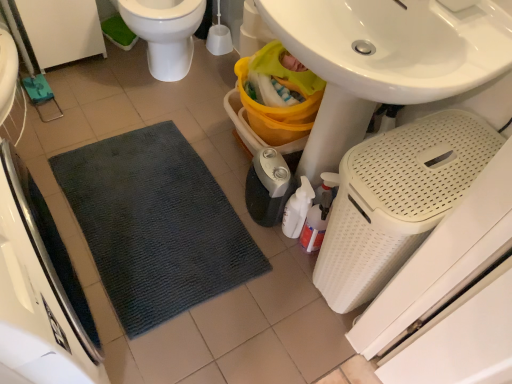
Locate an element on the screen. The width and height of the screenshot is (512, 384). white glossy toilet at upper left is located at coordinates (165, 33).

Considering the sizes of white perforated laundry basket at lower right, arranged as the 1th appliance when viewed from the right, and white glossy toilet at upper left in the image, is white perforated laundry basket at lower right, arranged as the 1th appliance when viewed from the right, wider or thinner than white glossy toilet at upper left?

In the image, white perforated laundry basket at lower right, arranged as the 1th appliance when viewed from the right, appears to be more narrow than white glossy toilet at upper left.

Can you confirm if white perforated laundry basket at lower right, the 3th appliance when ordered from left to right, is smaller than white glossy toilet at upper left?

Indeed, white perforated laundry basket at lower right, the 3th appliance when ordered from left to right, has a smaller size compared to white glossy toilet at upper left.

Between point (384, 274) and point (195, 14), which one is positioned in front?

Point (384, 274)

Is white perforated laundry basket at lower right, arranged as the 1th appliance when viewed from the right, oriented away from white glossy toilet at upper left?

white perforated laundry basket at lower right, arranged as the 1th appliance when viewed from the right, does not have its back to white glossy toilet at upper left.

Based on the photo, would you say translucent plastic spray bottle at lower center is to the left or to the right of black plastic humidifier at lower center, the 2th appliance from the right, in the picture?

Clearly, translucent plastic spray bottle at lower center is on the right of black plastic humidifier at lower center, the 2th appliance from the right, in the image.

Where is `cleaning product on the right of black plastic humidifier at lower center, the second appliance when ordered from left to right`? The height and width of the screenshot is (384, 512). cleaning product on the right of black plastic humidifier at lower center, the second appliance when ordered from left to right is located at coordinates (319, 214).

Does translucent plastic spray bottle at lower center have a lesser height compared to black plastic humidifier at lower center, the second appliance when ordered from left to right?

Incorrect, the height of translucent plastic spray bottle at lower center does not fall short of that of black plastic humidifier at lower center, the second appliance when ordered from left to right.

From a real-world perspective, is translucent plastic spray bottle at lower center on top of black plastic humidifier at lower center, the second appliance when ordered from left to right?

Yes, from a real-world perspective, translucent plastic spray bottle at lower center is above black plastic humidifier at lower center, the second appliance when ordered from left to right.

From the white glossy toilet at upper left, count 3rd appliances forward and point to it. Please provide its 2D coordinates.

[(36, 296)]

Does white glossy toilet at upper left have a greater width compared to dark gray textured mat at lower left, arranged as the 3th appliance when viewed from the right?

Yes.

Could you tell me if white glossy toilet at upper left is facing dark gray textured mat at lower left, which ranks as the first appliance in left-to-right order?

Yes, white glossy toilet at upper left is facing dark gray textured mat at lower left, which ranks as the first appliance in left-to-right order.

Which object is closer to the camera, white glossy toilet at upper left or dark gray textured mat at lower left, which ranks as the first appliance in left-to-right order?

dark gray textured mat at lower left, which ranks as the first appliance in left-to-right order.

Is white perforated laundry basket at lower right, the 3th appliance when ordered from left to right, positioned with its back to black plastic humidifier at lower center, the second appliance when ordered from left to right?

No, black plastic humidifier at lower center, the second appliance when ordered from left to right, is not at the back of white perforated laundry basket at lower right, the 3th appliance when ordered from left to right.

Based on the photo, based on their positions, is white perforated laundry basket at lower right, arranged as the 1th appliance when viewed from the right, located to the left or right of black plastic humidifier at lower center, the second appliance when ordered from left to right?

Based on their positions, white perforated laundry basket at lower right, arranged as the 1th appliance when viewed from the right, is located to the right of black plastic humidifier at lower center, the second appliance when ordered from left to right.

Considering the sizes of objects white perforated laundry basket at lower right, the 3th appliance when ordered from left to right, and black plastic humidifier at lower center, the 2th appliance from the right, in the image provided, who is shorter, white perforated laundry basket at lower right, the 3th appliance when ordered from left to right, or black plastic humidifier at lower center, the 2th appliance from the right,?

Standing shorter between the two is black plastic humidifier at lower center, the 2th appliance from the right.

Which object is closer to the camera, dark gray textured mat at lower left, arranged as the 3th appliance when viewed from the right, or black plastic humidifier at lower center, the 2th appliance from the right?

dark gray textured mat at lower left, arranged as the 3th appliance when viewed from the right, is more forward.

Based on the photo, is dark gray textured mat at lower left, arranged as the 3th appliance when viewed from the right, facing towards black plastic humidifier at lower center, the second appliance when ordered from left to right?

Yes, dark gray textured mat at lower left, arranged as the 3th appliance when viewed from the right, is turned towards black plastic humidifier at lower center, the second appliance when ordered from left to right.

Can you confirm if dark gray textured mat at lower left, which ranks as the first appliance in left-to-right order, is wider than black plastic humidifier at lower center, the second appliance when ordered from left to right?

Indeed, dark gray textured mat at lower left, which ranks as the first appliance in left-to-right order, has a greater width compared to black plastic humidifier at lower center, the second appliance when ordered from left to right.

Is translucent plastic spray bottle at lower center situated inside dark gray textured mat at lower left, which ranks as the first appliance in left-to-right order, or outside?

translucent plastic spray bottle at lower center is spatially situated outside dark gray textured mat at lower left, which ranks as the first appliance in left-to-right order.

This screenshot has width=512, height=384. In the image, there is a dark gray textured mat at lower left, arranged as the 3th appliance when viewed from the right. Find the location of `cleaning product above it (from the image's perspective)`. cleaning product above it (from the image's perspective) is located at coordinates (319, 214).

From the image's perspective, is translucent plastic spray bottle at lower center above dark gray textured mat at lower left, arranged as the 3th appliance when viewed from the right?

Correct, translucent plastic spray bottle at lower center appears higher than dark gray textured mat at lower left, arranged as the 3th appliance when viewed from the right, in the image.

Is translucent plastic spray bottle at lower center to the left of dark gray textured mat at lower left, arranged as the 3th appliance when viewed from the right, from the viewer's perspective?

No, translucent plastic spray bottle at lower center is not to the left of dark gray textured mat at lower left, arranged as the 3th appliance when viewed from the right.

Is translucent plastic spray bottle at lower center inside the boundaries of white glossy toilet at upper left, or outside?

translucent plastic spray bottle at lower center is spatially situated outside white glossy toilet at upper left.

Considering the positions of objects translucent plastic spray bottle at lower center and white glossy toilet at upper left in the image provided, who is behind, translucent plastic spray bottle at lower center or white glossy toilet at upper left?

white glossy toilet at upper left is more distant.

Does translucent plastic spray bottle at lower center turn towards white glossy toilet at upper left?

No, translucent plastic spray bottle at lower center is not oriented towards white glossy toilet at upper left.

Is translucent plastic spray bottle at lower center to the right of white glossy toilet at upper left from the viewer's perspective?

Indeed, translucent plastic spray bottle at lower center is positioned on the right side of white glossy toilet at upper left.

The width and height of the screenshot is (512, 384). In the image, there is a white perforated laundry basket at lower right, the 3th appliance when ordered from left to right. In order to click on toilet above it (from the image's perspective) in this screenshot , I will do `click(165, 33)`.

The height and width of the screenshot is (384, 512). In order to click on cleaning product on the right of black plastic humidifier at lower center, the second appliance when ordered from left to right in this screenshot , I will do `click(319, 214)`.

When comparing their distances from black plastic humidifier at lower center, the second appliance when ordered from left to right, does translucent plastic spray bottle at lower center or dark gray textured mat at lower left, which ranks as the first appliance in left-to-right order, seem further?

dark gray textured mat at lower left, which ranks as the first appliance in left-to-right order, is further to black plastic humidifier at lower center, the second appliance when ordered from left to right.

From the image, which object appears to be farther from black plastic humidifier at lower center, the 2th appliance from the right, white glossy toilet at upper left or white perforated laundry basket at lower right, arranged as the 1th appliance when viewed from the right?

Based on the image, white glossy toilet at upper left appears to be further to black plastic humidifier at lower center, the 2th appliance from the right.

Considering their positions, is white glossy toilet at upper left positioned further to white perforated laundry basket at lower right, arranged as the 1th appliance when viewed from the right, than translucent plastic spray bottle at lower center?

white glossy toilet at upper left is positioned further to the anchor white perforated laundry basket at lower right, arranged as the 1th appliance when viewed from the right.

When comparing their distances from black plastic humidifier at lower center, the 2th appliance from the right, does white glossy toilet at upper left or dark gray textured mat at lower left, arranged as the 3th appliance when viewed from the right, seem closer?

The object closer to black plastic humidifier at lower center, the 2th appliance from the right, is white glossy toilet at upper left.

Estimate the real-world distances between objects in this image. Which object is further from white perforated laundry basket at lower right, the 3th appliance when ordered from left to right, black plastic humidifier at lower center, the 2th appliance from the right, or white glossy toilet at upper left?

The object further to white perforated laundry basket at lower right, the 3th appliance when ordered from left to right, is white glossy toilet at upper left.

Based on their spatial positions, is translucent plastic spray bottle at lower center or white perforated laundry basket at lower right, the 3th appliance when ordered from left to right, further from white glossy toilet at upper left?

white perforated laundry basket at lower right, the 3th appliance when ordered from left to right.

From the image, which object appears to be nearer to black plastic humidifier at lower center, the second appliance when ordered from left to right, dark gray textured mat at lower left, arranged as the 3th appliance when viewed from the right, or white glossy toilet at upper left?

Among the two, white glossy toilet at upper left is located nearer to black plastic humidifier at lower center, the second appliance when ordered from left to right.

Considering their positions, is dark gray textured mat at lower left, which ranks as the first appliance in left-to-right order, positioned closer to white perforated laundry basket at lower right, arranged as the 1th appliance when viewed from the right, than white glossy toilet at upper left?

dark gray textured mat at lower left, which ranks as the first appliance in left-to-right order, is closer to white perforated laundry basket at lower right, arranged as the 1th appliance when viewed from the right.

The image size is (512, 384). In order to click on appliance between white glossy toilet at upper left and white perforated laundry basket at lower right, arranged as the 1th appliance when viewed from the right, vertically in this screenshot , I will do `click(268, 187)`.

Locate an element on the screen. This screenshot has width=512, height=384. appliance positioned between dark gray textured mat at lower left, arranged as the 3th appliance when viewed from the right, and black plastic humidifier at lower center, the 2th appliance from the right, from near to far is located at coordinates (396, 200).

Locate an element on the screen. cleaning product between white perforated laundry basket at lower right, arranged as the 1th appliance when viewed from the right, and black plastic humidifier at lower center, the second appliance when ordered from left to right, along the z-axis is located at coordinates (319, 214).

Identify the location of cleaning product between dark gray textured mat at lower left, arranged as the 3th appliance when viewed from the right, and white glossy toilet at upper left, along the z-axis. (319, 214).